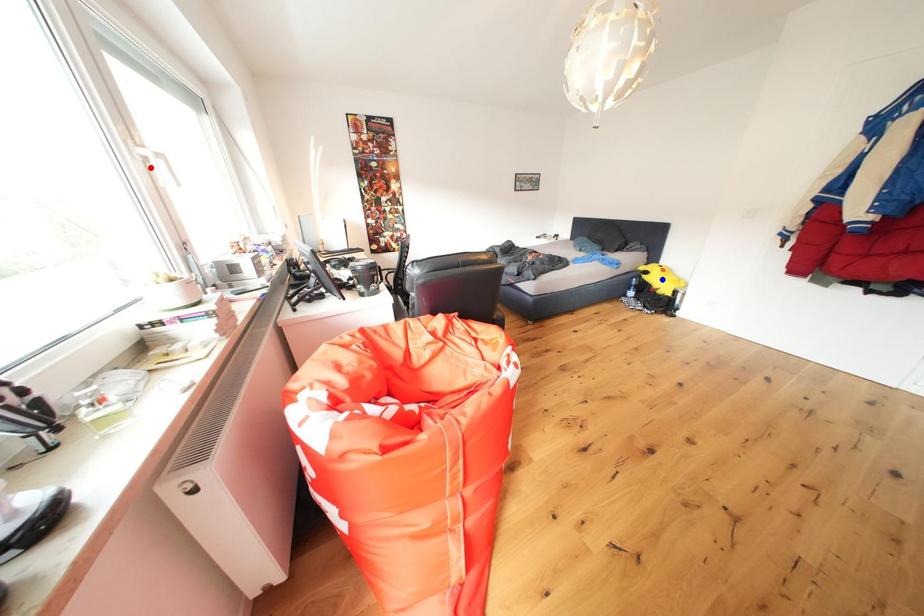
Question: Which of the two points in the image is closer to the camera?

Choices:
 (A) Blue point is closer.
 (B) Red point is closer.

Answer: (B)